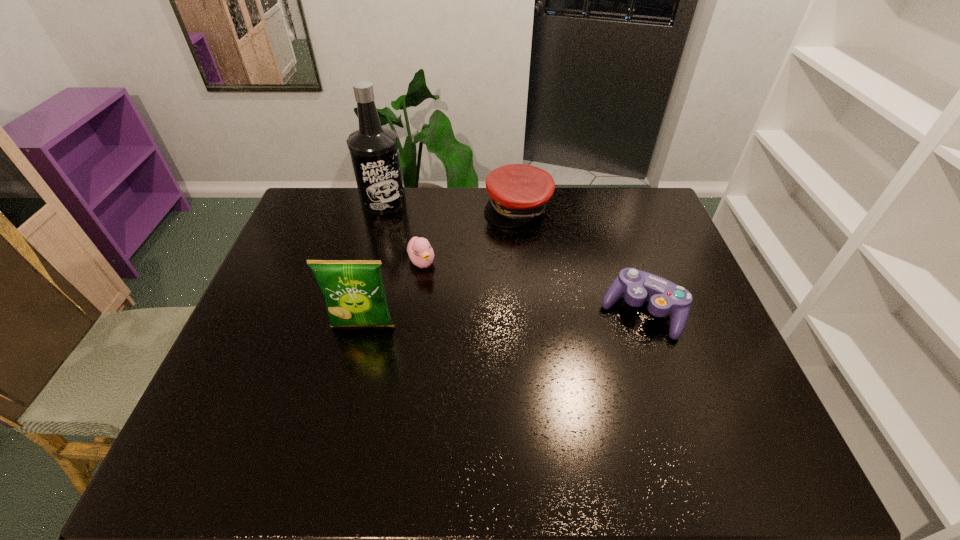
At what (x,y) coordinates should I click in order to perform the action: click on free space on the desktop that is between the crisp (potato chip) and the rightmost object and is positioned on the front-facing side of the cap. Please return your answer as a coordinate pair (x, y). This screenshot has width=960, height=540. Looking at the image, I should click on (543, 317).

Find the location of `free spot on the desktop that is between the fourth shortest object and the rightmost object and is positioned on the front label of the liquor`. free spot on the desktop that is between the fourth shortest object and the rightmost object and is positioned on the front label of the liquor is located at coordinates 472,320.

The width and height of the screenshot is (960, 540). Identify the location of vacant space on the desktop that is between the second tallest object and the rightmost object and is positioned on the front-facing side of the third object from right to left. (463, 321).